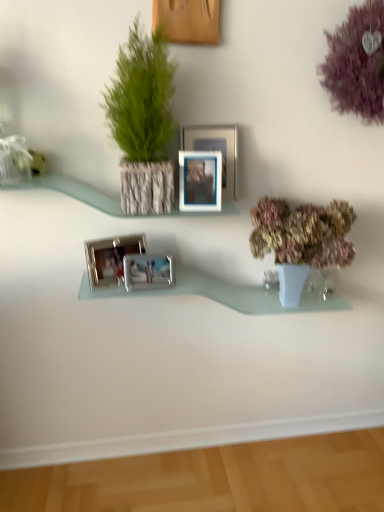
Question: Is green textured plant at upper left, arranged as the second houseplant when ordered from the bottom, in front of or behind clear glass vase at lower right in the image?

Choices:
 (A) front
 (B) behind

Answer: (A)

Question: From a real-world perspective, relative to clear glass vase at lower right, is green textured plant at upper left, arranged as the second houseplant when ordered from the bottom, vertically above or below?

Choices:
 (A) below
 (B) above

Answer: (B)

Question: Estimate the real-world distances between objects in this image. Which object is farther from the clear glass vase at lower right?

Choices:
 (A) matte wooden shelf at upper center, which ranks as the 1th shelf in top-to-bottom order
 (B) metallic silver picture frame at upper center, which is counted as the third picture frame, starting from the bottom
 (C) pastel pink floral arrangement at right, the first houseplant positioned from the bottom
 (D) silver metallic photo frame at center, which ranks as the 4th picture frame in top-to-bottom order
 (E) silver metallic photo frame at center, the fifth picture frame viewed from the top

Answer: (A)

Question: Estimate the real-world distances between objects in this image. Which object is closer to the silver metallic picture frame at upper center, the second picture frame positioned from the top?

Choices:
 (A) clear glass vase at lower right
 (B) metallic silver picture frame at upper center, the 3th picture frame viewed from the top
 (C) purple fluffy flower at upper right
 (D) silver metallic photo frame at center, the 1th picture frame from the bottom
 (E) green textured plant at upper left, which is the first houseplant from left to right

Answer: (B)